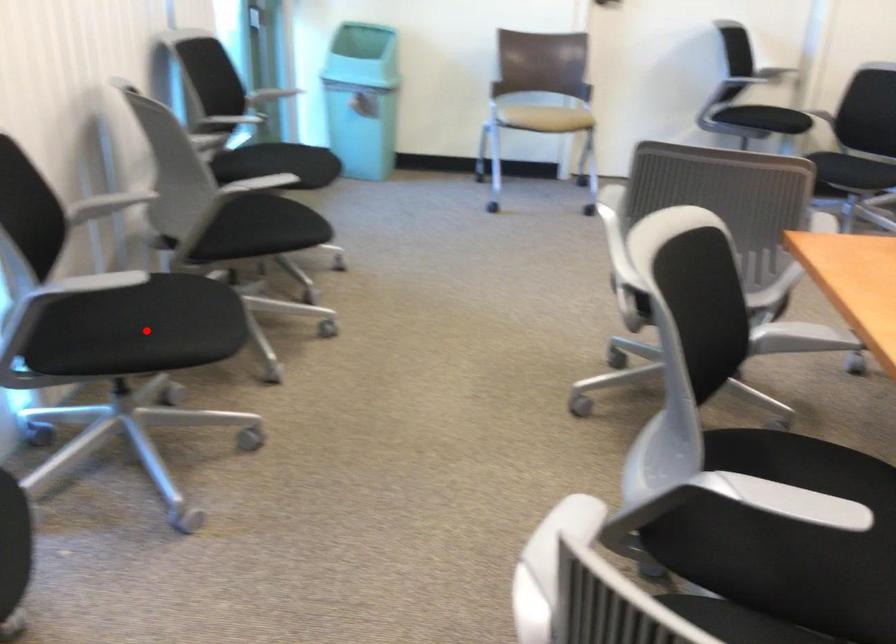
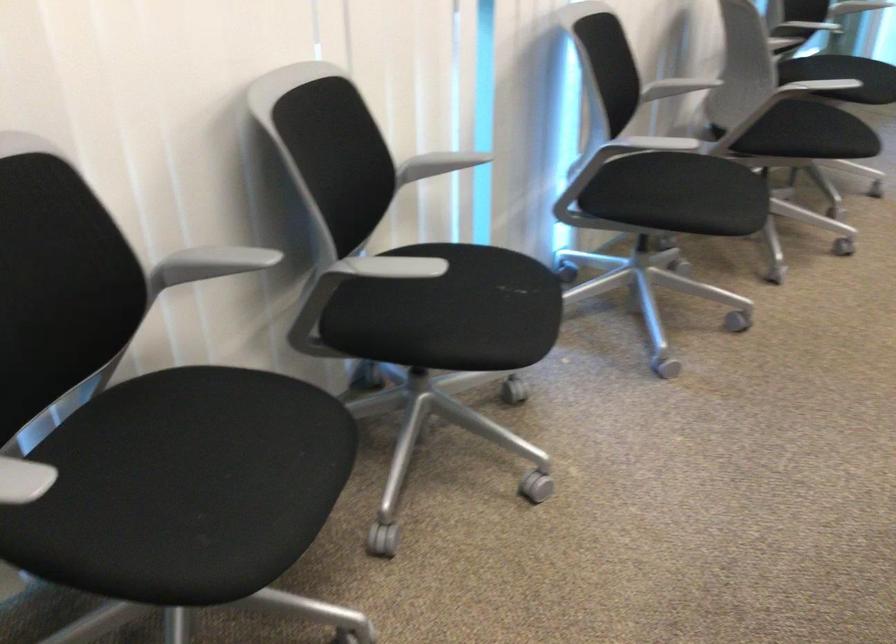
Question: I am providing you with two images of the same scene from different viewpoints. Image1 has a red point marked. In image2, the corresponding 3D location appears at what relative position? Reply with the corresponding letter.

Choices:
 (A) Closer
 (B) Farther

Answer: (B)